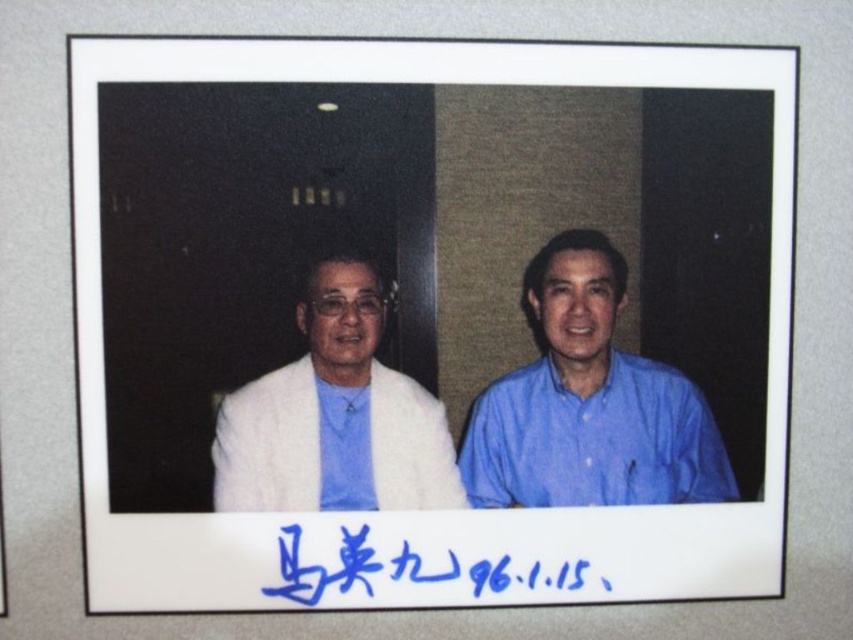
Which of these two, blue cotton shirt at right or white fur coat at left, stands taller?

blue cotton shirt at right

Can you confirm if blue cotton shirt at right is positioned below white fur coat at left?

Yes, blue cotton shirt at right is below white fur coat at left.

At what (x,y) coordinates should I click in order to perform the action: click on blue cotton shirt at right. Please return your answer as a coordinate pair (x, y). This screenshot has width=853, height=640. Looking at the image, I should click on (589, 403).

Is point (387, 483) positioned behind point (369, 412)?

That is True.

Does white fur coat at left have a smaller size compared to blue fabric shirt at center?

No.

The width and height of the screenshot is (853, 640). I want to click on white fur coat at left, so click(334, 417).

Where is `white fur coat at left`? white fur coat at left is located at coordinates (334, 417).

Between blue cotton shirt at right and blue handwritten text at lower center, which one is positioned lower?

Positioned lower is blue handwritten text at lower center.

In order to click on blue cotton shirt at right in this screenshot , I will do `click(589, 403)`.